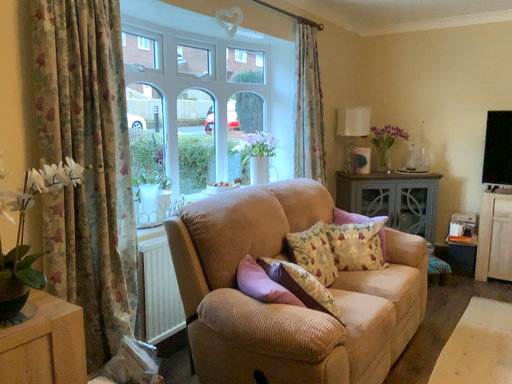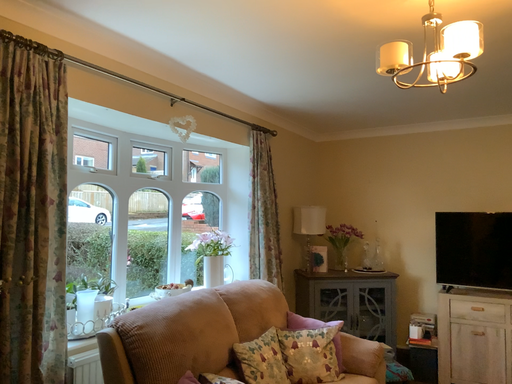
Question: How did the camera likely rotate when shooting the video?

Choices:
 (A) rotated downward
 (B) rotated upward

Answer: (B)